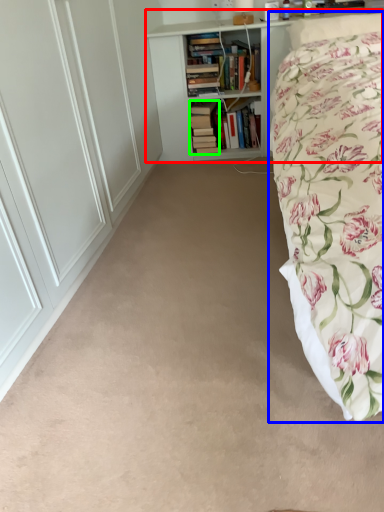
Question: Which is nearer to the bookcase (highlighted by a red box)? bed (highlighted by a blue box) or book (highlighted by a green box).

Choices:
 (A) bed
 (B) book

Answer: (B)